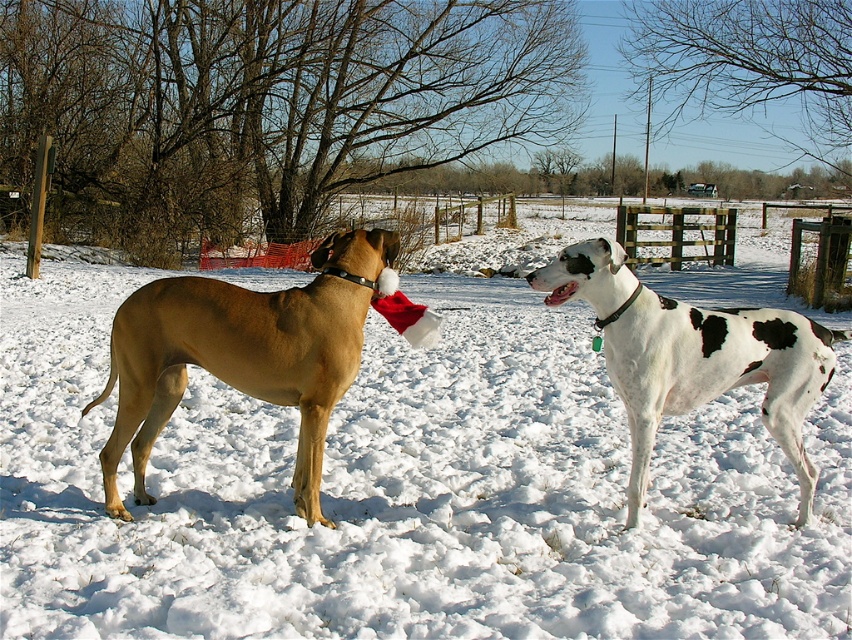
Question: Which object is the farthest from the golden fur coat at left?

Choices:
 (A) white-spotted fur at center
 (B) white fluffy snow at center

Answer: (B)

Question: Can you confirm if golden fur coat at left is positioned to the right of white-spotted fur at center?

Choices:
 (A) no
 (B) yes

Answer: (A)

Question: Is white fluffy snow at center to the left of golden fur coat at left from the viewer's perspective?

Choices:
 (A) no
 (B) yes

Answer: (A)

Question: Which object appears farthest from the camera in this image?

Choices:
 (A) white-spotted fur at center
 (B) white fluffy snow at center
 (C) golden fur coat at left

Answer: (C)

Question: Which is nearer to the white-spotted fur at center?

Choices:
 (A) white fluffy snow at center
 (B) golden fur coat at left

Answer: (B)

Question: Is golden fur coat at left to the left of white-spotted fur at center from the viewer's perspective?

Choices:
 (A) yes
 (B) no

Answer: (A)